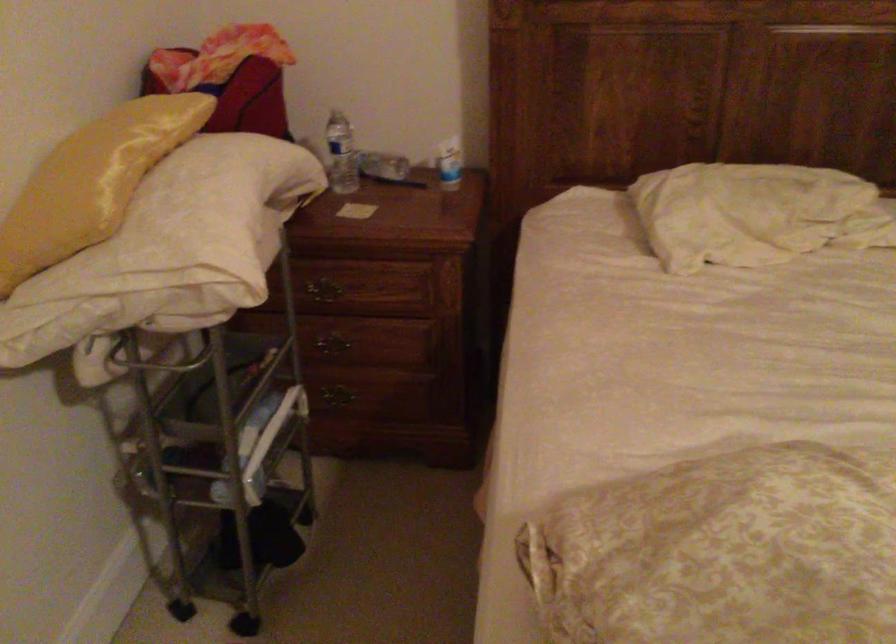
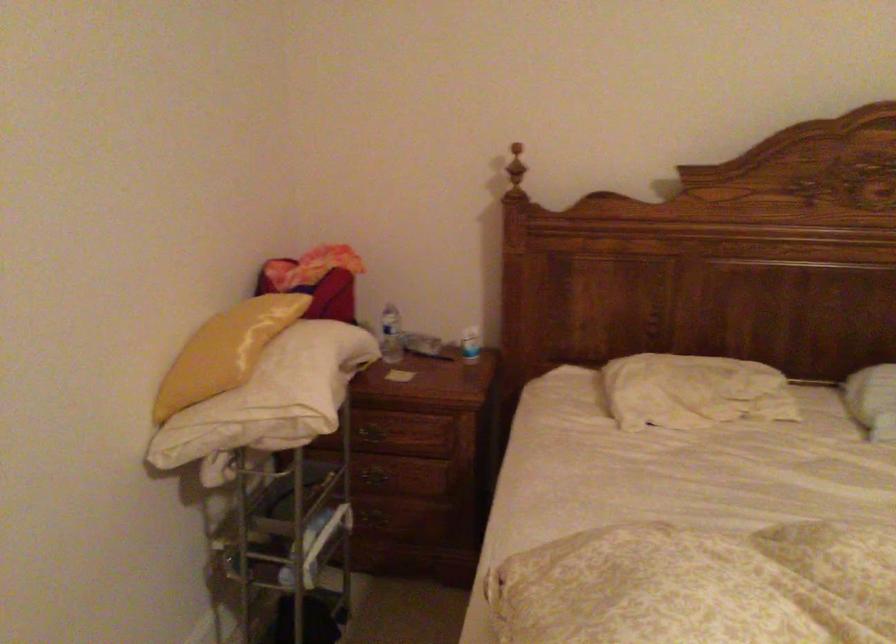
Find the pixel in the second image that matches pixel 341 391 in the first image.

(381, 516)